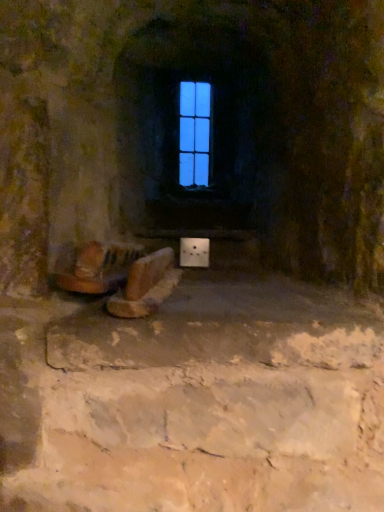
Question: Is blue glass window at center wider or thinner than wooden stool at lower center?

Choices:
 (A) thin
 (B) wide

Answer: (A)

Question: Does point (185, 133) appear closer or farther from the camera than point (150, 280)?

Choices:
 (A) closer
 (B) farther

Answer: (B)

Question: From the image's perspective, relative to wooden stool at lower center, is blue glass window at center above or below?

Choices:
 (A) above
 (B) below

Answer: (A)

Question: From a real-world perspective, relative to blue glass window at center, is wooden stool at lower center vertically above or below?

Choices:
 (A) above
 (B) below

Answer: (B)

Question: From the image's perspective, is wooden stool at lower center positioned above or below blue glass window at center?

Choices:
 (A) below
 (B) above

Answer: (A)

Question: Considering the relative positions of wooden stool at lower center and blue glass window at center in the image provided, is wooden stool at lower center to the left or to the right of blue glass window at center?

Choices:
 (A) left
 (B) right

Answer: (A)

Question: Considering the positions of point (140, 312) and point (188, 96), is point (140, 312) closer or farther from the camera than point (188, 96)?

Choices:
 (A) farther
 (B) closer

Answer: (B)